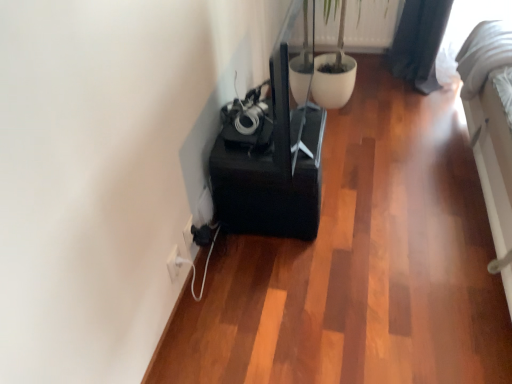
Question: Is the surface of white plastic electric outlet at lower left, marked as the 2th electric outlet in a back-to-front arrangement, in direct contact with white plastic electric outlet at lower left, the 2th electric outlet from the front?

Choices:
 (A) yes
 (B) no

Answer: (B)

Question: Does white plastic electric outlet at lower left, marked as the 2th electric outlet in a back-to-front arrangement, have a greater height compared to white plastic electric outlet at lower left, the 1th electric outlet from the right?

Choices:
 (A) no
 (B) yes

Answer: (B)

Question: Can you confirm if white plastic electric outlet at lower left, which is the 2th electric outlet from right to left, is smaller than white plastic electric outlet at lower left, the 2th electric outlet from the front?

Choices:
 (A) yes
 (B) no

Answer: (A)

Question: Is white plastic electric outlet at lower left, the 1th electric outlet viewed from the back, located within white plastic electric outlet at lower left, which is the 2th electric outlet from right to left?

Choices:
 (A) yes
 (B) no

Answer: (B)

Question: From a real-world perspective, is white plastic electric outlet at lower left, positioned as the 1th electric outlet in left-to-right order, on top of white plastic electric outlet at lower left, the 1th electric outlet viewed from the back?

Choices:
 (A) yes
 (B) no

Answer: (A)

Question: From the image's perspective, would you say white plastic electric outlet at lower left, positioned as the 1th electric outlet in left-to-right order, is positioned over white plastic electric outlet at lower left, which is the 2th electric outlet in left-to-right order?

Choices:
 (A) no
 (B) yes

Answer: (A)

Question: Considering the relative sizes of white plastic electric outlet at lower left, the 1th electric outlet viewed from the back, and green matte plant at upper center in the image provided, is white plastic electric outlet at lower left, the 1th electric outlet viewed from the back, bigger than green matte plant at upper center?

Choices:
 (A) no
 (B) yes

Answer: (A)

Question: From a real-world perspective, does white plastic electric outlet at lower left, which is the 2th electric outlet in left-to-right order, stand above green matte plant at upper center?

Choices:
 (A) no
 (B) yes

Answer: (A)

Question: Can you confirm if white plastic electric outlet at lower left, the 1th electric outlet viewed from the back, is smaller than green matte plant at upper center?

Choices:
 (A) no
 (B) yes

Answer: (B)

Question: Can you see white plastic electric outlet at lower left, the 1th electric outlet from the right, touching green matte plant at upper center?

Choices:
 (A) yes
 (B) no

Answer: (B)

Question: Is white plastic electric outlet at lower left, the 1th electric outlet viewed from the back, positioned with its back to green matte plant at upper center?

Choices:
 (A) no
 (B) yes

Answer: (A)

Question: Does white plastic electric outlet at lower left, the 2th electric outlet from the front, have a lesser width compared to green matte plant at upper center?

Choices:
 (A) yes
 (B) no

Answer: (A)

Question: Does green matte plant at upper center come behind white plastic electric outlet at lower left, the 1th electric outlet from the right?

Choices:
 (A) yes
 (B) no

Answer: (A)